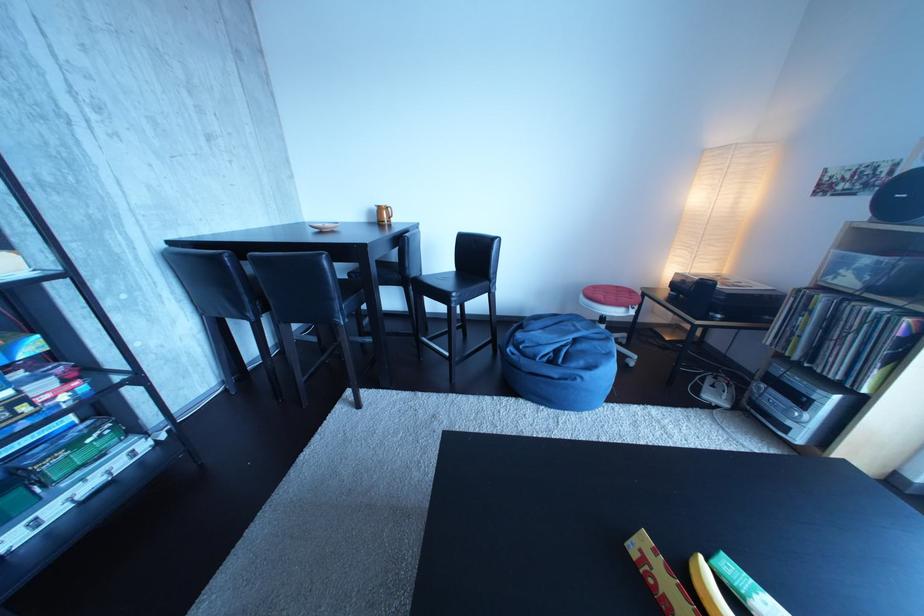
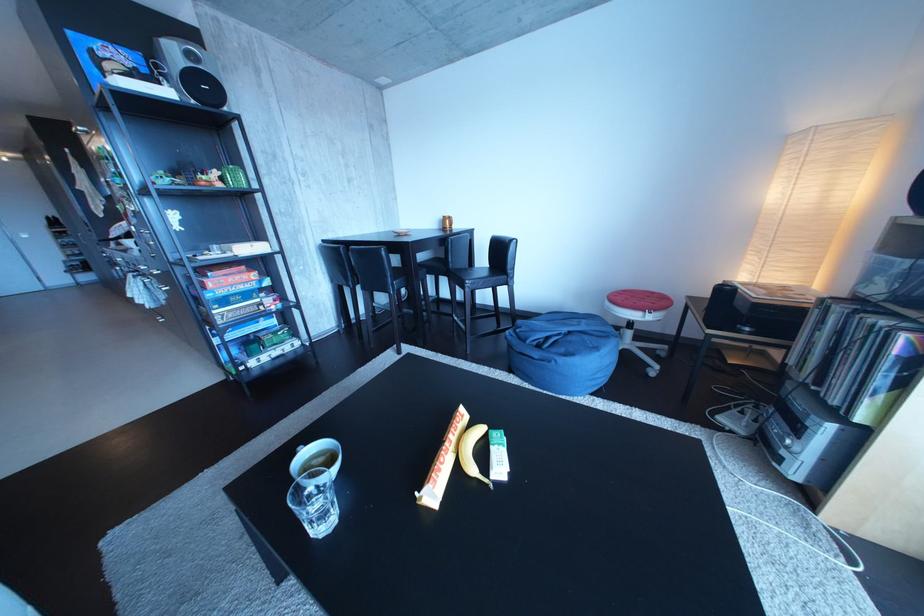
Find the pixel in the second image that matches (630,293) in the first image.

(666, 299)